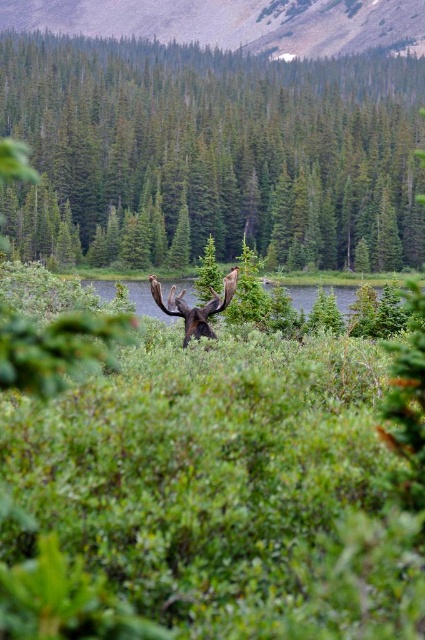
You are a hiker who wants to take a photo of the green leafy tree at center from exactly 100 meters away. Based on the scene, can you position yourself at that distance?

The green leafy tree at center and viewer are 114.56 meters apart from each other, so you cannot position yourself exactly 100 meters away from the green leafy tree at center since the current distance is farther than desired.

You are navigating through the dense vegetation in the scene and want to reach the point at coordinates point (249, 17). You are currently at point (176, 316). Which direction should you move to get closer to your destination?

To reach point (249, 17) from point (176, 316), you should move towards the left and slightly downward since point (249, 17) is located to the left and slightly above point (176, 316).

You are a hiker trying to navigate through the dense vegetation. You see the green leafy tree at center and the green grassy lake at center. Which object is larger in size?

The green leafy tree at center is bigger than the green grassy lake at center, so the green leafy tree at center is larger in size.